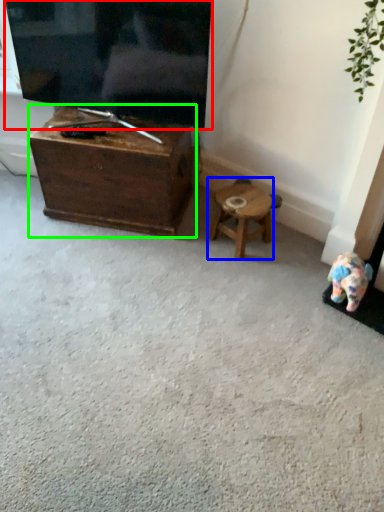
Question: Considering the real-world distances, which object is farthest from television (highlighted by a red box)? stool (highlighted by a blue box) or table (highlighted by a green box)?

Choices:
 (A) stool
 (B) table

Answer: (A)